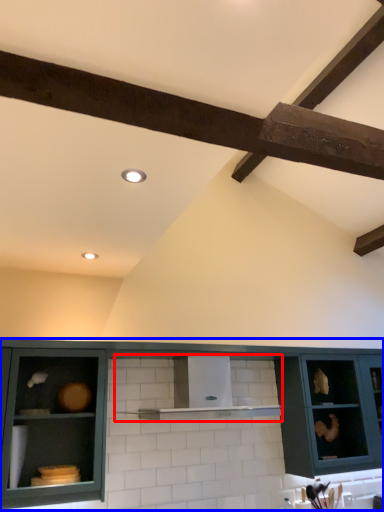
Question: Which object is further to the camera taking this photo, shelf (highlighted by a red box) or cabinetry (highlighted by a blue box)?

Choices:
 (A) shelf
 (B) cabinetry

Answer: (A)